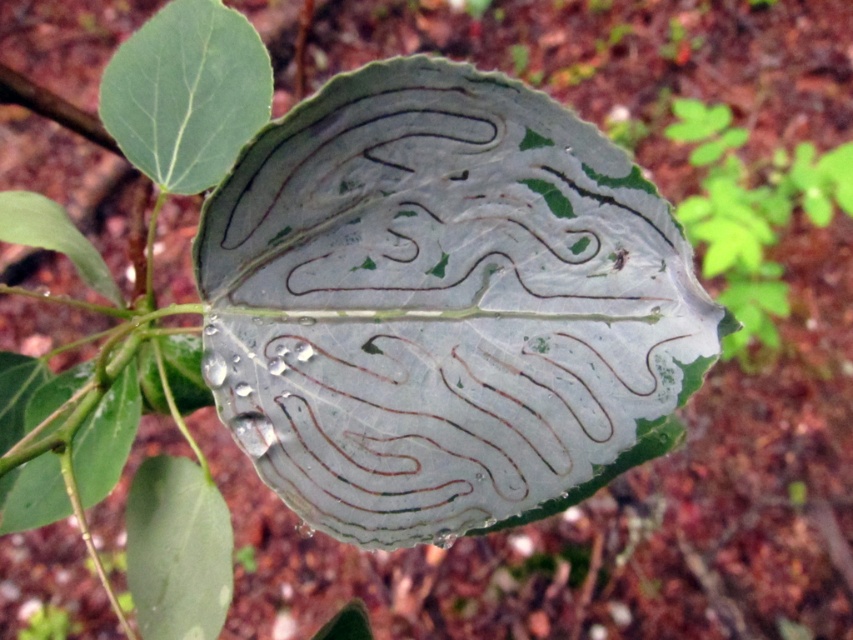
Based on the photo, can you confirm if green matte leaf at upper left is smaller than green matte leaf at lower left?

Yes, green matte leaf at upper left is smaller than green matte leaf at lower left.

Between point (184, 99) and point (206, 477), which one is positioned behind?

Point (184, 99)

Between point (149, 83) and point (167, 492), which one is positioned behind?

Point (167, 492)

You are a GUI agent. You are given a task and a screenshot of the screen. Output one action in this format:
    pyautogui.click(x=<x>, y=<y>)
    Task: Click on the green matte leaf at upper left
    
    Given the screenshot: What is the action you would take?
    186,93

Who is higher up, green matte leaf at lower left or green translucent leaf at lower left?

Positioned higher is green translucent leaf at lower left.

Can you confirm if green matte leaf at lower left is positioned to the right of green translucent leaf at lower left?

Correct, you'll find green matte leaf at lower left to the right of green translucent leaf at lower left.

Does point (142, 611) lie in front of point (79, 445)?

Yes, point (142, 611) is in front of point (79, 445).

Find the location of a particular element. The height and width of the screenshot is (640, 853). green matte leaf at lower left is located at coordinates (177, 550).

Is green matte leaf at upper left to the right of green translucent leaf at lower left from the viewer's perspective?

Yes, green matte leaf at upper left is to the right of green translucent leaf at lower left.

Which is more to the left, green matte leaf at upper left or green translucent leaf at lower left?

From the viewer's perspective, green translucent leaf at lower left appears more on the left side.

Between point (241, 116) and point (56, 464), which one is positioned behind?

The point (56, 464) is behind.

Find the location of `green matte leaf at upper left`. green matte leaf at upper left is located at coordinates (186, 93).